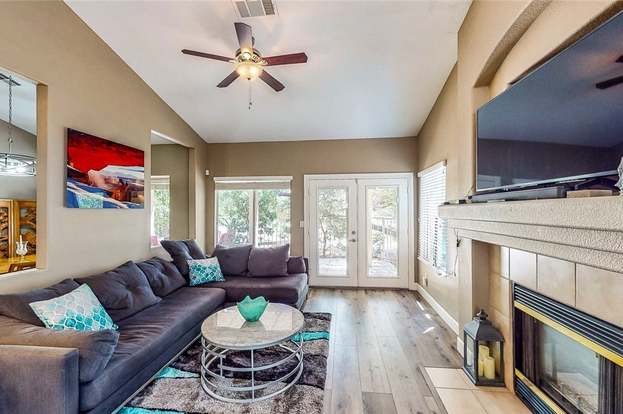
Identify the location of rug. (306, 393).